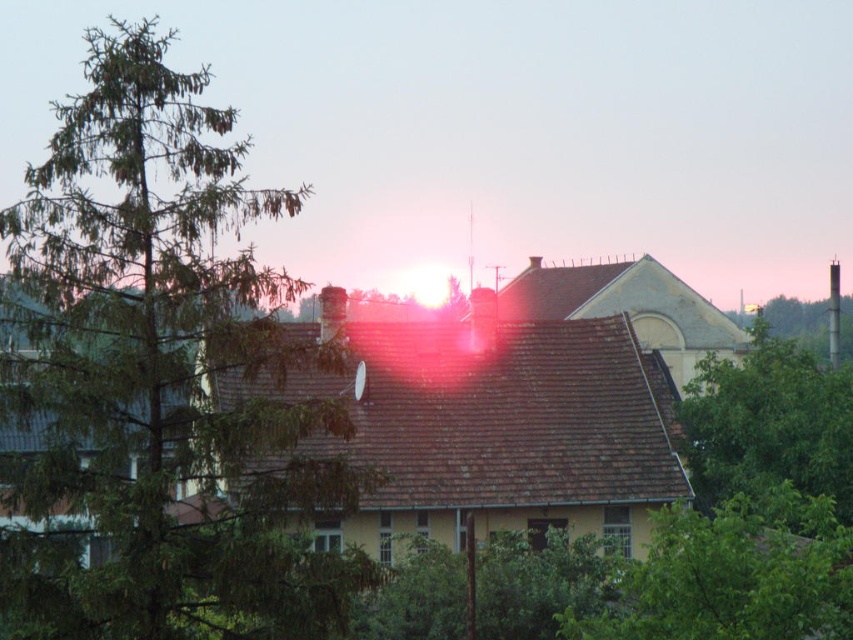
Consider the image. Between green leafy tree at lower right and green leafy tree at right, which one has less height?

green leafy tree at lower right

Between green leafy tree at lower right and green leafy tree at right, which one appears on the right side from the viewer's perspective?

From the viewer's perspective, green leafy tree at right appears more on the right side.

Is point (776, 593) in front of point (801, 422)?

Yes, point (776, 593) is in front of point (801, 422).

I want to click on green leafy tree at lower right, so click(734, 573).

What do you see at coordinates (158, 380) in the screenshot? The height and width of the screenshot is (640, 853). I see `green leafy tree at left` at bounding box center [158, 380].

Which is in front, point (107, 596) or point (465, 588)?

Point (107, 596) is more forward.

Locate an element on the screen. green leafy tree at left is located at coordinates (158, 380).

Is green leafy tree at right smaller than green leafy tree at center?

No.

Measure the distance between green leafy tree at right and green leafy tree at center.

A distance of 9.21 meters exists between green leafy tree at right and green leafy tree at center.

Which is behind, point (833, 406) or point (537, 582)?

The point (833, 406) is behind.

Locate an element on the screen. Image resolution: width=853 pixels, height=640 pixels. green leafy tree at right is located at coordinates (769, 422).